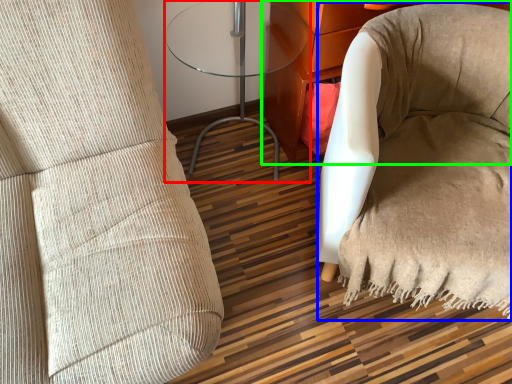
Question: Which object is positioned farthest from table (highlighted by a red box)? Select from bean bag chair (highlighted by a blue box) and furniture (highlighted by a green box).

Choices:
 (A) bean bag chair
 (B) furniture

Answer: (A)